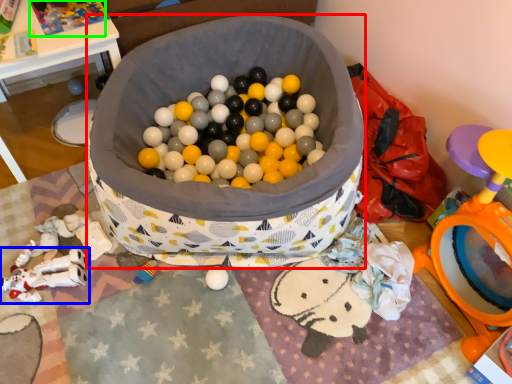
Question: Which object is positioned farthest from laundry basket (highlighted by a red box)? Select from toy (highlighted by a blue box) and toy (highlighted by a green box).

Choices:
 (A) toy
 (B) toy

Answer: (A)